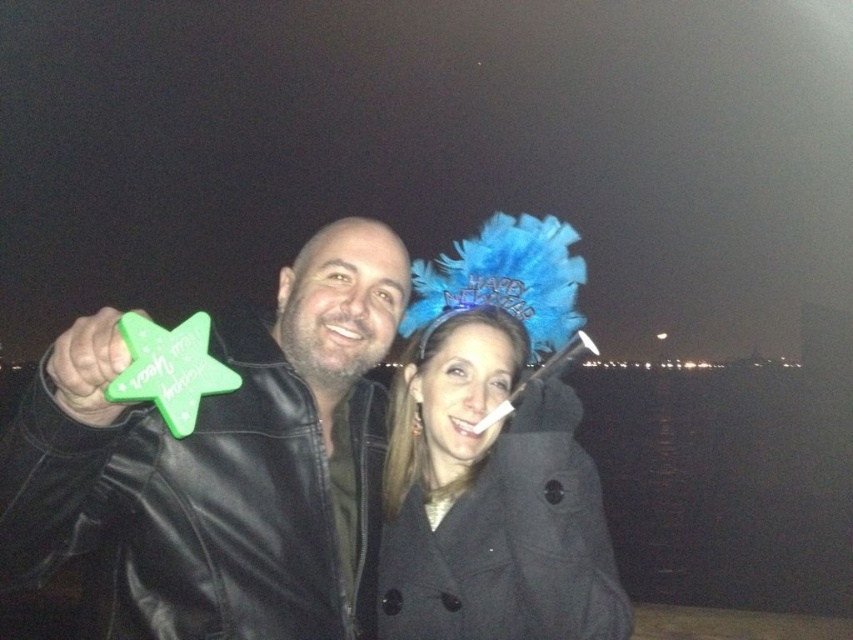
You are a photographer trying to capture a clear photo of both the green matte star at left and the black wool coat at center. Since the camera can only focus on one object at a time, which object should you choose to ensure the other is still somewhat in focus?

The green matte star at left might be wider than black wool coat at center, so focusing on the green matte star at left would help keep the black wool coat at center in better focus due to its larger size.

You are organizing a New Year party and need to choose decorations. You have a green matte star at left and a black wool coat at center. Which decoration is bigger?

The green matte star at left has a larger size compared to the black wool coat at center, so the green matte star at left is bigger.